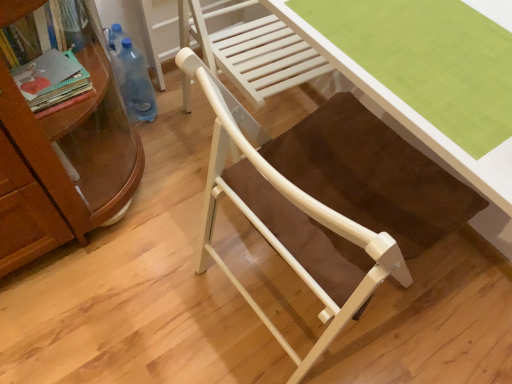
Identify the location of blank area to the left of matte white chair at center. The height and width of the screenshot is (384, 512). (157, 274).